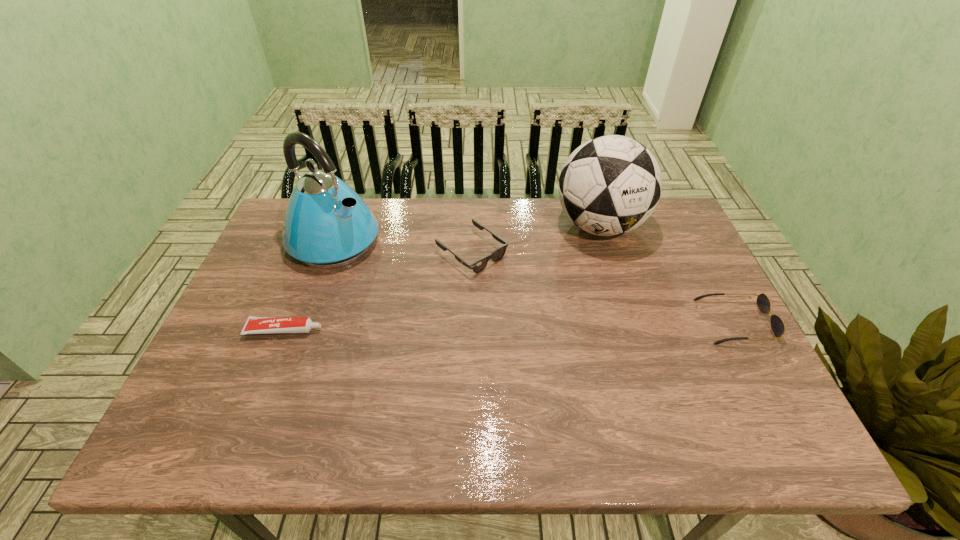
I want to click on sunglasses that is at the far edge, so click(x=478, y=266).

This screenshot has width=960, height=540. Identify the location of toothpaste located in the left edge section of the desktop. (254, 325).

Image resolution: width=960 pixels, height=540 pixels. What are the coordinates of `kettle located in the left edge section of the desktop` in the screenshot? It's located at (x=327, y=224).

At what (x,y) coordinates should I click in order to perform the action: click on sunglasses that is positioned at the right edge. Please return your answer as a coordinate pair (x, y). This screenshot has height=540, width=960. Looking at the image, I should click on (778, 327).

Identify the location of soccer ball positioned at the right edge. (610, 185).

At what (x,y) coordinates should I click in order to perform the action: click on object positioned at the far left corner. Please return your answer as a coordinate pair (x, y). This screenshot has height=540, width=960. Looking at the image, I should click on (327, 224).

At what (x,y) coordinates should I click in order to perform the action: click on object at the far right corner. Please return your answer as a coordinate pair (x, y). Looking at the image, I should click on (610, 185).

At what (x,y) coordinates should I click in order to perform the action: click on vacant space at the far edge. Please return your answer as a coordinate pair (x, y). The image size is (960, 540). Looking at the image, I should click on (529, 200).

This screenshot has width=960, height=540. I want to click on vacant space at the left edge of the desktop, so click(291, 262).

Identify the location of vacant space at the right edge of the desktop. (682, 330).